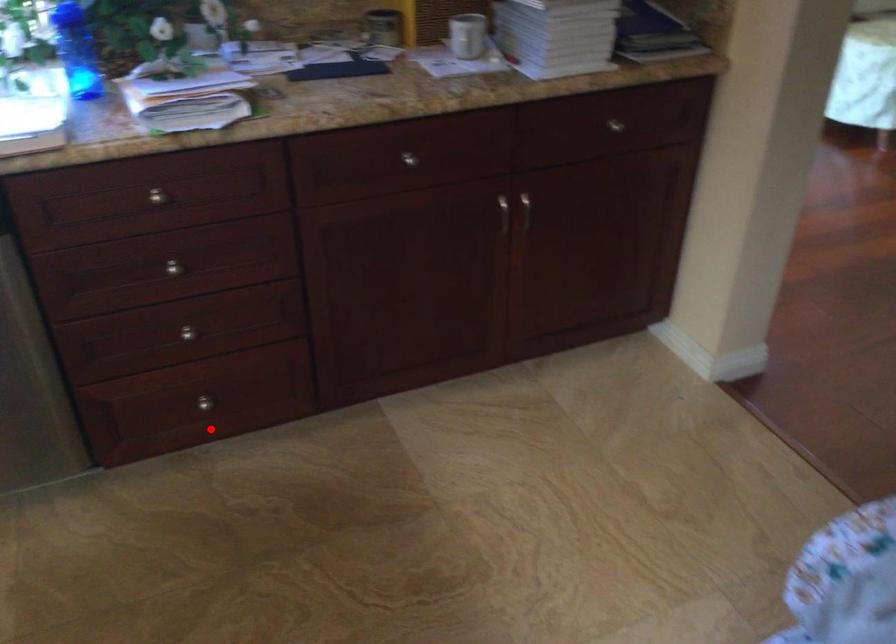
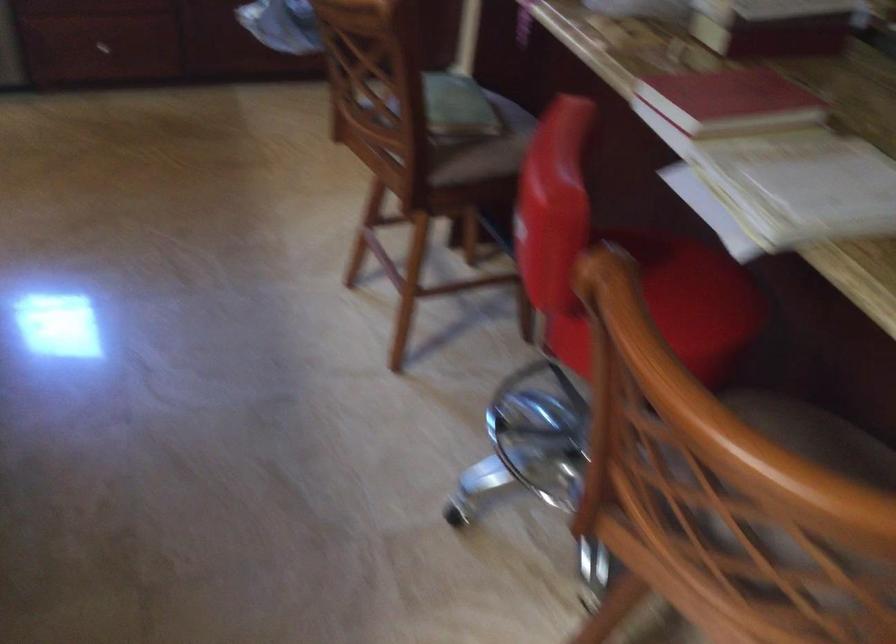
Question: I am providing you with two images of the same scene from different viewpoints. Given a red point in image1, look at the same physical point in image2. Is it:

Choices:
 (A) Closer to the viewpoint
 (B) Farther from the viewpoint

Answer: (B)